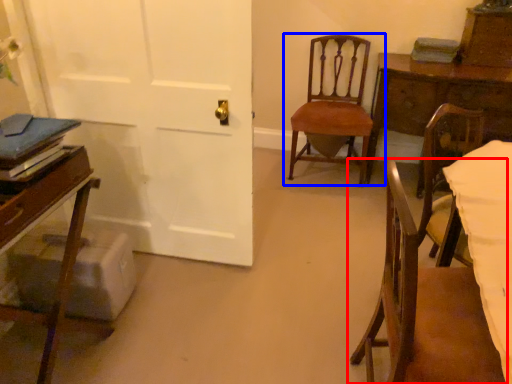
Question: Which point is further to the camera, chair (highlighted by a red box) or chair (highlighted by a blue box)?

Choices:
 (A) chair
 (B) chair

Answer: (B)